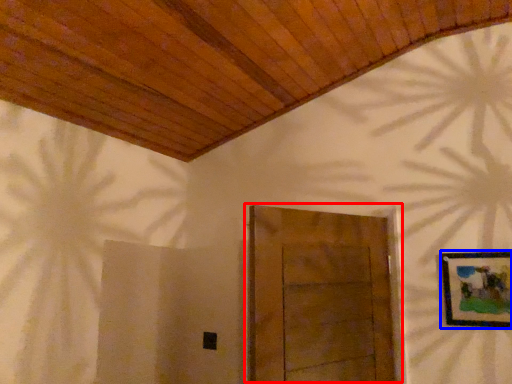
Question: Which object appears farthest to the camera in this image, door (highlighted by a red box) or picture frame (highlighted by a blue box)?

Choices:
 (A) door
 (B) picture frame

Answer: (B)